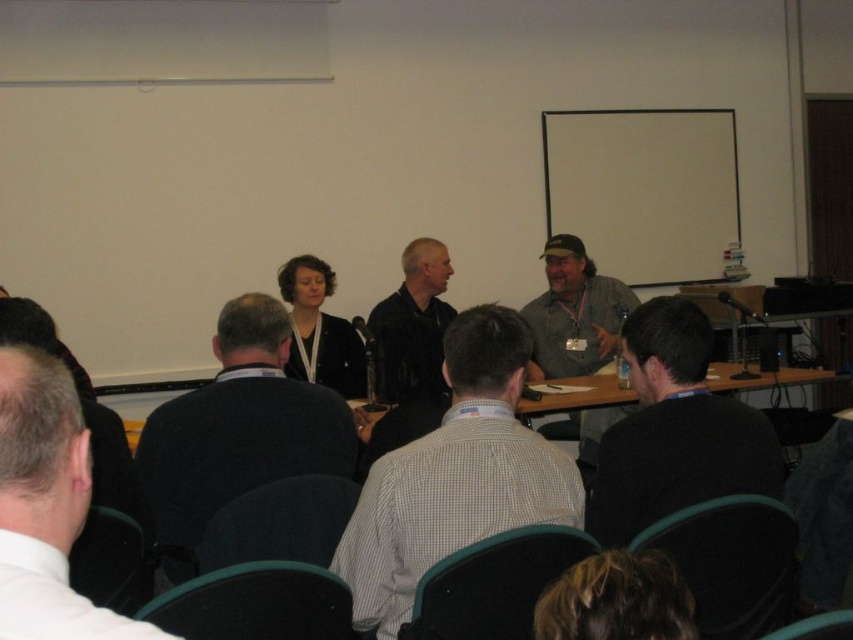
Based on the photo, is gray fabric shirt at center above wooden table at center?

Correct, gray fabric shirt at center is located above wooden table at center.

Which is in front, point (549, 372) or point (151, 406)?

Positioned in front is point (549, 372).

The image size is (853, 640). In order to click on gray fabric shirt at center in this screenshot , I will do `click(573, 312)`.

Which is below, dark blue sweater at center or black matte shirt at lower right?

A: Positioned lower is dark blue sweater at center.

Does dark blue sweater at center appear on the right side of black matte shirt at lower right?

No, dark blue sweater at center is not to the right of black matte shirt at lower right.

Identify the location of dark blue sweater at center. Image resolution: width=853 pixels, height=640 pixels. (236, 432).

Who is positioned more to the right, dark blue sweater at center or white shirt at left?

white shirt at left is more to the right.

I want to click on dark blue sweater at center, so click(236, 432).

I want to click on dark blue sweater at center, so click(236, 432).